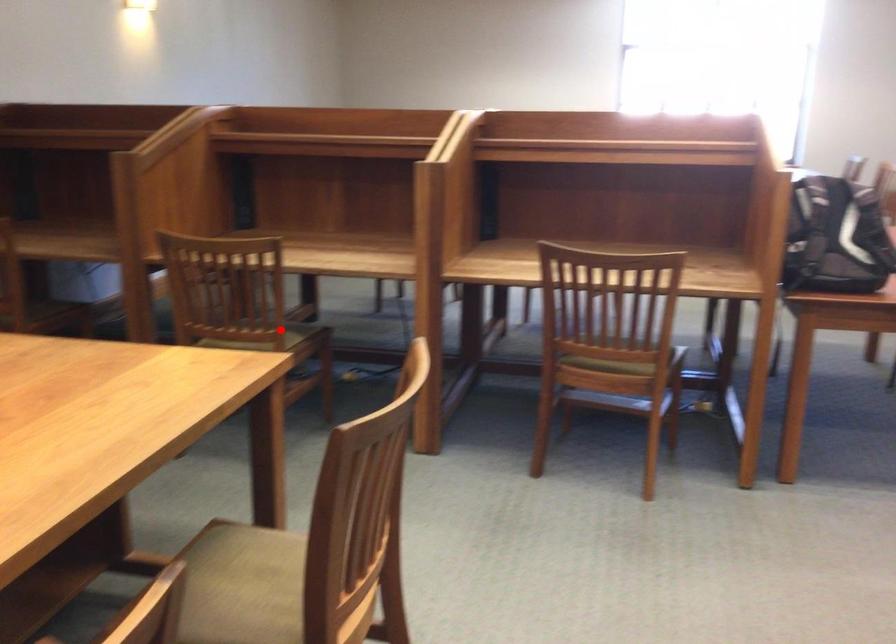
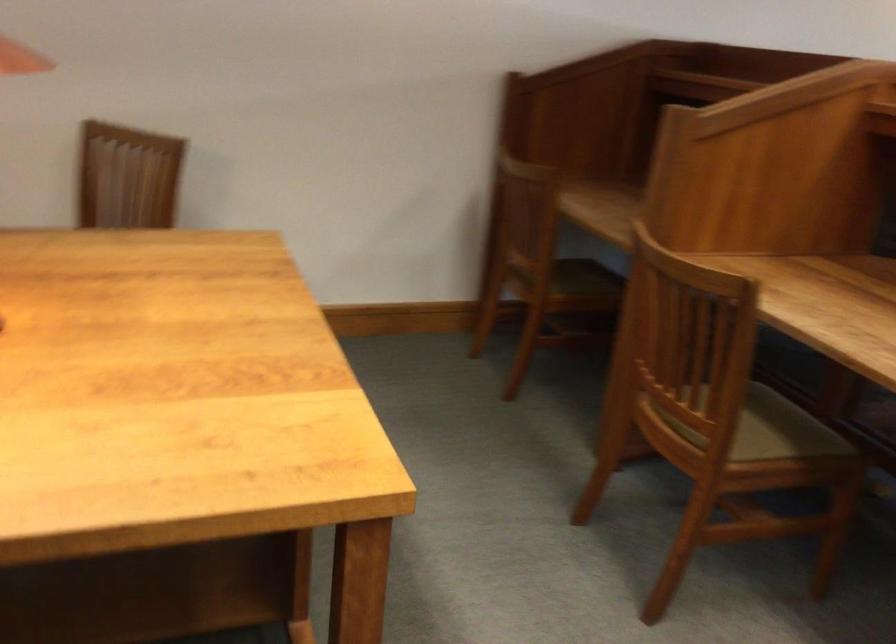
Question: A red point is marked in image1. In image2, is the corresponding 3D point closer to the camera or farther? Reply with the corresponding letter.

Choices:
 (A) The corresponding 3D point is closer.
 (B) The corresponding 3D point is farther.

Answer: (A)